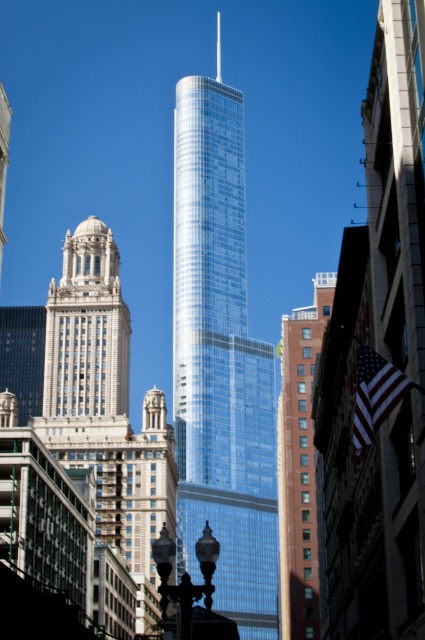
Does white stone tower at left have a smaller size compared to glassy steel skyscraper at right?

No, white stone tower at left is not smaller than glassy steel skyscraper at right.

The image size is (425, 640). What do you see at coordinates (105, 406) in the screenshot?
I see `white stone tower at left` at bounding box center [105, 406].

Does point (127, 529) lie behind point (285, 545)?

Yes.

Identify the location of white stone tower at left. The width and height of the screenshot is (425, 640). (105, 406).

Is glassy steel skyscraper at right bigger than silky fabric flag at right?

Indeed, glassy steel skyscraper at right has a larger size compared to silky fabric flag at right.

Is glassy steel skyscraper at right taller than silky fabric flag at right?

Indeed, glassy steel skyscraper at right has a greater height compared to silky fabric flag at right.

The image size is (425, 640). Identify the location of glassy steel skyscraper at right. (299, 464).

The height and width of the screenshot is (640, 425). I want to click on glassy steel skyscraper at right, so click(299, 464).

Is point (229, 545) positioned in front of point (397, 381)?

No, it is behind (397, 381).

Is point (272, 518) in front of point (391, 384)?

No, (272, 518) is further to viewer.

Where is `shiny glass skyscraper at center`? The width and height of the screenshot is (425, 640). shiny glass skyscraper at center is located at coordinates (221, 362).